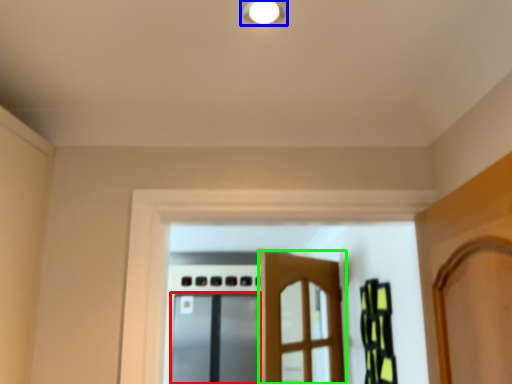
Question: Which object is positioned closest to screen door (highlighted by a red box)? Select from light fixture (highlighted by a blue box) and door (highlighted by a green box).

Choices:
 (A) light fixture
 (B) door

Answer: (B)